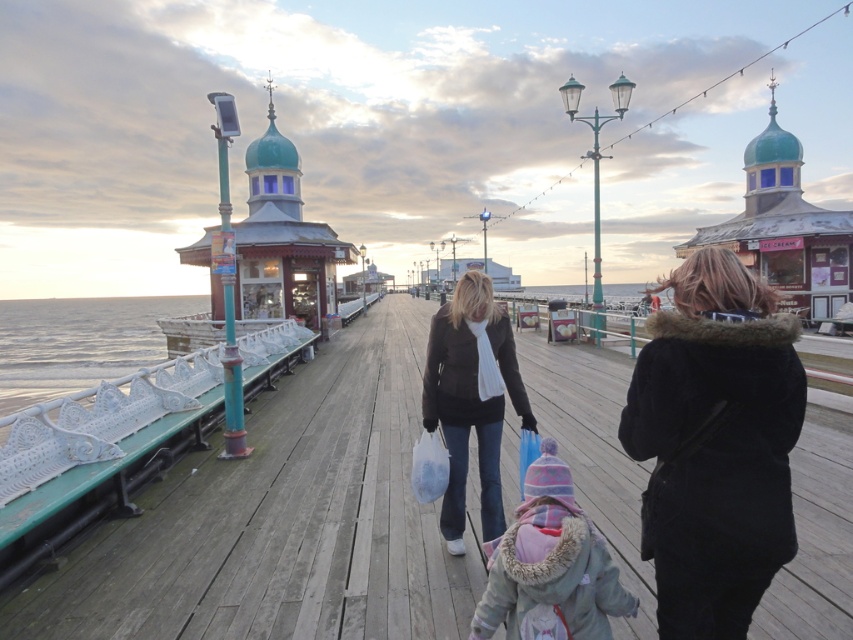
Consider the image. Is fluffy pink coat at center above dark brown leather jacket at center?

Incorrect, fluffy pink coat at center is not positioned above dark brown leather jacket at center.

This screenshot has height=640, width=853. Describe the element at coordinates (550, 564) in the screenshot. I see `fluffy pink coat at center` at that location.

Is point (534, 584) closer to viewer compared to point (492, 509)?

Yes, point (534, 584) is in front of point (492, 509).

Where is `fluffy pink coat at center`? The height and width of the screenshot is (640, 853). fluffy pink coat at center is located at coordinates (550, 564).

Who is higher up, black fur-lined coat at center or dark brown leather jacket at center?

black fur-lined coat at center is above.

Which is behind, point (796, 376) or point (439, 419)?

The point (439, 419) is more distant.

Image resolution: width=853 pixels, height=640 pixels. I want to click on black fur-lined coat at center, so click(715, 444).

Which is behind, point (601, 376) or point (461, 444)?

The point (601, 376) is behind.

Who is positioned more to the right, wooden dock at center or dark brown leather jacket at center?

From the viewer's perspective, dark brown leather jacket at center appears more on the right side.

This screenshot has width=853, height=640. Identify the location of wooden dock at center. (282, 520).